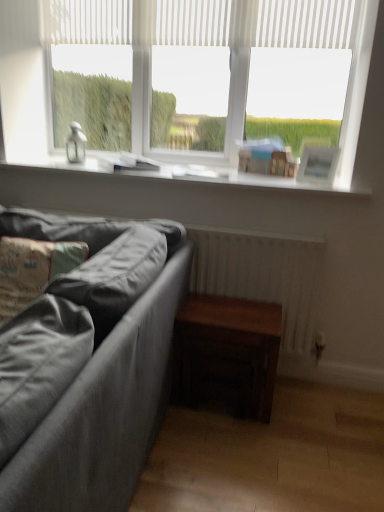
Question: Is textured gray pillow at lower left at the right side of white smooth window sill at upper center?

Choices:
 (A) no
 (B) yes

Answer: (A)

Question: Can we say textured gray pillow at lower left lies outside white smooth window sill at upper center?

Choices:
 (A) yes
 (B) no

Answer: (A)

Question: Does textured gray pillow at lower left have a greater height compared to white smooth window sill at upper center?

Choices:
 (A) yes
 (B) no

Answer: (A)

Question: Is textured gray pillow at lower left far away from white smooth window sill at upper center?

Choices:
 (A) yes
 (B) no

Answer: (B)

Question: From a real-world perspective, is textured gray pillow at lower left on top of white smooth window sill at upper center?

Choices:
 (A) yes
 (B) no

Answer: (B)

Question: Considering the relative positions of textured gray pillow at lower left and white smooth window sill at upper center in the image provided, is textured gray pillow at lower left to the left of white smooth window sill at upper center from the viewer's perspective?

Choices:
 (A) no
 (B) yes

Answer: (B)

Question: Does white smooth window sill at upper center have a lesser height compared to dark wood table at lower right?

Choices:
 (A) yes
 (B) no

Answer: (A)

Question: Is white smooth window sill at upper center to the right of dark wood table at lower right from the viewer's perspective?

Choices:
 (A) no
 (B) yes

Answer: (A)

Question: Considering the relative sizes of white smooth window sill at upper center and dark wood table at lower right in the image provided, is white smooth window sill at upper center wider than dark wood table at lower right?

Choices:
 (A) yes
 (B) no

Answer: (A)

Question: Does white smooth window sill at upper center have a lesser width compared to dark wood table at lower right?

Choices:
 (A) yes
 (B) no

Answer: (B)

Question: From the image's perspective, is white smooth window sill at upper center located above dark wood table at lower right?

Choices:
 (A) yes
 (B) no

Answer: (A)

Question: From a real-world perspective, does white smooth window sill at upper center stand above dark wood table at lower right?

Choices:
 (A) no
 (B) yes

Answer: (B)

Question: From the image's perspective, does white smooth window sill at upper center appear lower than textured gray fabric couch at lower left?

Choices:
 (A) yes
 (B) no

Answer: (B)